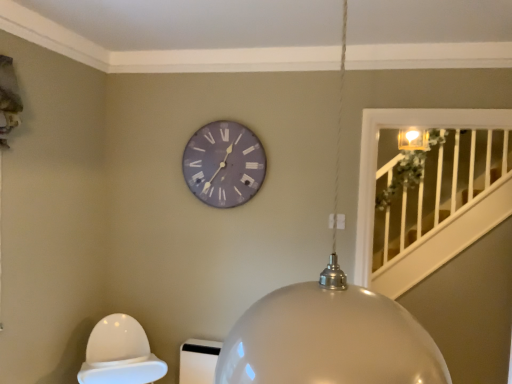
The width and height of the screenshot is (512, 384). What do you see at coordinates (224, 164) in the screenshot? I see `purple matte clock at upper center` at bounding box center [224, 164].

In order to click on purple matte clock at upper center in this screenshot , I will do `click(224, 164)`.

Based on the photo, what is the approximate width of purple matte clock at upper center?

purple matte clock at upper center is 1.20 inches in width.

This screenshot has width=512, height=384. In order to click on glossy metallic globe at center in this screenshot , I will do `click(329, 337)`.

Measure the distance between point (x=281, y=342) and camera.

Point (x=281, y=342) and camera are 24.09 inches apart.

This screenshot has width=512, height=384. What do you see at coordinates (329, 337) in the screenshot? I see `glossy metallic globe at center` at bounding box center [329, 337].

What are the coordinates of `purple matte clock at upper center` in the screenshot? It's located at (x=224, y=164).

Between purple matte clock at upper center and glossy metallic globe at center, which one appears on the right side from the viewer's perspective?

Positioned to the right is glossy metallic globe at center.

Who is more distant, purple matte clock at upper center or glossy metallic globe at center?

purple matte clock at upper center.

Which is in front, point (211, 192) or point (240, 341)?

The point (240, 341) is closer.

From the image's perspective, is purple matte clock at upper center above glossy metallic globe at center?

Yes, from the image's perspective, purple matte clock at upper center is over glossy metallic globe at center.

From a real-world perspective, which object rests below the other?

glossy metallic globe at center.

Between purple matte clock at upper center and glossy metallic globe at center, which one has larger width?

glossy metallic globe at center.

Considering the sizes of purple matte clock at upper center and glossy metallic globe at center in the image, is purple matte clock at upper center taller or shorter than glossy metallic globe at center?

In the image, purple matte clock at upper center appears to be shorter than glossy metallic globe at center.

Is purple matte clock at upper center smaller than glossy metallic globe at center?

Correct, purple matte clock at upper center occupies less space than glossy metallic globe at center.

Do you think purple matte clock at upper center is within glossy metallic globe at center, or outside of it?

purple matte clock at upper center lies outside glossy metallic globe at center.

Is purple matte clock at upper center not near glossy metallic globe at center?

Yes, purple matte clock at upper center and glossy metallic globe at center are quite far apart.

Is purple matte clock at upper center positioned with its back to glossy metallic globe at center?

No, glossy metallic globe at center is not at the back of purple matte clock at upper center.

How different are the orientations of purple matte clock at upper center and glossy metallic globe at center in degrees?

90 degrees.

The image size is (512, 384). What are the coordinates of `wall clock above the glossy metallic globe at center (from a real-world perspective)` in the screenshot? It's located at (224, 164).

Which is more to the right, glossy metallic globe at center or purple matte clock at upper center?

From the viewer's perspective, glossy metallic globe at center appears more on the right side.

Relative to purple matte clock at upper center, is glossy metallic globe at center in front or behind?

Visually, glossy metallic globe at center is located in front of purple matte clock at upper center.

Which point is more distant from viewer, (x=229, y=351) or (x=248, y=166)?

The point (x=248, y=166) is behind.

From the image's perspective, is glossy metallic globe at center above or below purple matte clock at upper center?

glossy metallic globe at center is below purple matte clock at upper center.

From a real-world perspective, is glossy metallic globe at center above or below purple matte clock at upper center?

glossy metallic globe at center is situated lower than purple matte clock at upper center in the real world.

Considering the sizes of objects glossy metallic globe at center and purple matte clock at upper center in the image provided, who is wider, glossy metallic globe at center or purple matte clock at upper center?

glossy metallic globe at center.

Is glossy metallic globe at center taller or shorter than purple matte clock at upper center?

glossy metallic globe at center is taller than purple matte clock at upper center.

Consider the image. Between glossy metallic globe at center and purple matte clock at upper center, which one has larger size?

glossy metallic globe at center is bigger.

From the picture: Would you say glossy metallic globe at center contains purple matte clock at upper center?

No, purple matte clock at upper center is located outside of glossy metallic globe at center.

Are glossy metallic globe at center and purple matte clock at upper center beside each other?

No, glossy metallic globe at center is not in contact with purple matte clock at upper center.

Is glossy metallic globe at center facing away from purple matte clock at upper center?

No.

How different are the orientations of glossy metallic globe at center and purple matte clock at upper center in degrees?

The angle between the facing direction of glossy metallic globe at center and the facing direction of purple matte clock at upper center is 90 degrees.

How far apart are glossy metallic globe at center and purple matte clock at upper center?

The distance of glossy metallic globe at center from purple matte clock at upper center is 1.52 meters.

Identify the location of lamp in front of the purple matte clock at upper center. The width and height of the screenshot is (512, 384). (329, 337).

This screenshot has height=384, width=512. Identify the location of wall clock above the glossy metallic globe at center (from the image's perspective). (224, 164).

I want to click on lamp in front of the purple matte clock at upper center, so click(x=329, y=337).